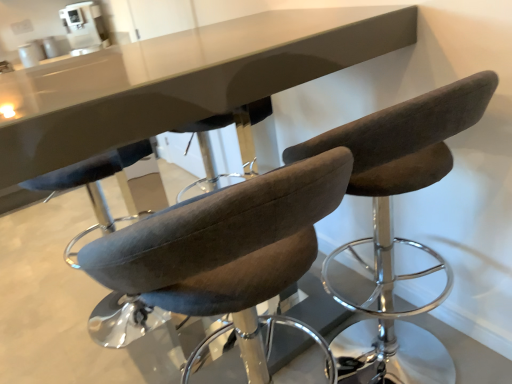
Identify the location of white plastic coffee machine at upper center. The image size is (512, 384). (84, 27).

You are a GUI agent. You are given a task and a screenshot of the screen. Output one action in this format:
    pyautogui.click(x=<x>, y=<y>)
    Task: Click on the white plastic coffee machine at upper center
    This screenshot has width=512, height=384.
    Given the screenshot: What is the action you would take?
    pyautogui.click(x=84, y=27)

Considering the positions of objects white plastic coffee machine at upper center and velvet brown stool at center, the 2th chair from the right, in the image provided, who is more to the right, white plastic coffee machine at upper center or velvet brown stool at center, the 2th chair from the right,?

From the viewer's perspective, velvet brown stool at center, the 2th chair from the right, appears more on the right side.

Who is bigger, white plastic coffee machine at upper center or velvet brown stool at center, the 1th chair viewed from the left?

With larger size is velvet brown stool at center, the 1th chair viewed from the left.

Does white plastic coffee machine at upper center have a lesser height compared to velvet brown stool at center, the 2th chair from the right?

Correct, white plastic coffee machine at upper center is not as tall as velvet brown stool at center, the 2th chair from the right.

How distant is white plastic coffee machine at upper center from velvet brown stool at center, the 1th chair viewed from the left?

3.12 meters.

How different are the orientations of dark brown fabric chair at center, acting as the second chair starting from the left, and white plastic coffee machine at upper center in degrees?

The angle between the facing direction of dark brown fabric chair at center, acting as the second chair starting from the left, and the facing direction of white plastic coffee machine at upper center is 146 degrees.

From a real-world perspective, who is located higher, dark brown fabric chair at center, positioned as the first chair in right-to-left order, or white plastic coffee machine at upper center?

white plastic coffee machine at upper center is physically above.

Looking at this image, is dark brown fabric chair at center, positioned as the first chair in right-to-left order, wider than white plastic coffee machine at upper center?

Yes.

Is dark brown fabric chair at center, acting as the second chair starting from the left, positioned with its back to white plastic coffee machine at upper center?

No, dark brown fabric chair at center, acting as the second chair starting from the left, is not facing away from white plastic coffee machine at upper center.

Is white plastic coffee machine at upper center facing away from dark brown fabric chair at center, positioned as the first chair in right-to-left order?

white plastic coffee machine at upper center is not turned away from dark brown fabric chair at center, positioned as the first chair in right-to-left order.

Does white plastic coffee machine at upper center have a greater width compared to dark brown fabric chair at center, positioned as the first chair in right-to-left order?

In fact, white plastic coffee machine at upper center might be narrower than dark brown fabric chair at center, positioned as the first chair in right-to-left order.

From a real-world perspective, is white plastic coffee machine at upper center positioned over dark brown fabric chair at center, positioned as the first chair in right-to-left order, based on gravity?

Indeed, from a real-world perspective, white plastic coffee machine at upper center stands above dark brown fabric chair at center, positioned as the first chair in right-to-left order.

Is dark brown fabric chair at center, positioned as the first chair in right-to-left order, surrounded by white plastic coffee machine at upper center?

That's incorrect, dark brown fabric chair at center, positioned as the first chair in right-to-left order, is not inside white plastic coffee machine at upper center.

Can you see dark brown fabric chair at center, acting as the second chair starting from the left, touching velvet brown stool at center, the 1th chair viewed from the left?

dark brown fabric chair at center, acting as the second chair starting from the left, and velvet brown stool at center, the 1th chair viewed from the left, are not in contact.

Could you tell me if dark brown fabric chair at center, acting as the second chair starting from the left, is turned towards velvet brown stool at center, the 1th chair viewed from the left?

No.

Is dark brown fabric chair at center, positioned as the first chair in right-to-left order, situated inside velvet brown stool at center, the 2th chair from the right, or outside?

dark brown fabric chair at center, positioned as the first chair in right-to-left order, is not enclosed by velvet brown stool at center, the 2th chair from the right.

Is point (442, 101) behind point (170, 284)?

That is True.

From the image's perspective, relative to white plastic coffee machine at upper center, is velvet brown stool at center, the 1th chair viewed from the left, above or below?

velvet brown stool at center, the 1th chair viewed from the left, is situated lower than white plastic coffee machine at upper center in the image.

Who is taller, velvet brown stool at center, the 2th chair from the right, or white plastic coffee machine at upper center?

Standing taller between the two is velvet brown stool at center, the 2th chair from the right.

Does point (302, 194) come in front of point (87, 48)?

Yes, it is.

Is velvet brown stool at center, the 2th chair from the right, aimed at white plastic coffee machine at upper center?

Yes.

Considering the relative positions of velvet brown stool at center, the 2th chair from the right, and dark brown fabric chair at center, positioned as the first chair in right-to-left order, in the image provided, is velvet brown stool at center, the 2th chair from the right, to the left or to the right of dark brown fabric chair at center, positioned as the first chair in right-to-left order,?

velvet brown stool at center, the 2th chair from the right, is to the left of dark brown fabric chair at center, positioned as the first chair in right-to-left order.

Measure the distance between velvet brown stool at center, the 1th chair viewed from the left, and dark brown fabric chair at center, acting as the second chair starting from the left.

velvet brown stool at center, the 1th chair viewed from the left, and dark brown fabric chair at center, acting as the second chair starting from the left, are 32.34 centimeters apart from each other.

Is velvet brown stool at center, the 2th chair from the right, shorter than dark brown fabric chair at center, acting as the second chair starting from the left?

Yes, velvet brown stool at center, the 2th chair from the right, is shorter than dark brown fabric chair at center, acting as the second chair starting from the left.

Where is `the 1st chair to the right when counting from the white plastic coffee machine at upper center`? This screenshot has height=384, width=512. the 1st chair to the right when counting from the white plastic coffee machine at upper center is located at coordinates (219, 226).

Where is `coffee machine above the dark brown fabric chair at center, positioned as the first chair in right-to-left order (from the image's perspective)`? The width and height of the screenshot is (512, 384). coffee machine above the dark brown fabric chair at center, positioned as the first chair in right-to-left order (from the image's perspective) is located at coordinates (84, 27).

Based on their spatial positions, is white plastic coffee machine at upper center or dark brown fabric chair at center, acting as the second chair starting from the left, further from velvet brown stool at center, the 1th chair viewed from the left?

white plastic coffee machine at upper center.

Looking at the image, which one is located further to dark brown fabric chair at center, acting as the second chair starting from the left, white plastic coffee machine at upper center or velvet brown stool at center, the 1th chair viewed from the left?

Based on the image, white plastic coffee machine at upper center appears to be further to dark brown fabric chair at center, acting as the second chair starting from the left.

Based on their spatial positions, is dark brown fabric chair at center, acting as the second chair starting from the left, or white plastic coffee machine at upper center closer to velvet brown stool at center, the 2th chair from the right?

Based on the image, dark brown fabric chair at center, acting as the second chair starting from the left, appears to be nearer to velvet brown stool at center, the 2th chair from the right.

Based on their spatial positions, is velvet brown stool at center, the 2th chair from the right, or white plastic coffee machine at upper center further from dark brown fabric chair at center, acting as the second chair starting from the left?

white plastic coffee machine at upper center lies further to dark brown fabric chair at center, acting as the second chair starting from the left, than the other object.

Estimate the real-world distances between objects in this image. Which object is closer to white plastic coffee machine at upper center, dark brown fabric chair at center, positioned as the first chair in right-to-left order, or velvet brown stool at center, the 2th chair from the right?

dark brown fabric chair at center, positioned as the first chair in right-to-left order, is closer to white plastic coffee machine at upper center.

From the image, which object appears to be nearer to white plastic coffee machine at upper center, velvet brown stool at center, the 1th chair viewed from the left, or dark brown fabric chair at center, positioned as the first chair in right-to-left order?

dark brown fabric chair at center, positioned as the first chair in right-to-left order.

The width and height of the screenshot is (512, 384). I want to click on chair between velvet brown stool at center, the 2th chair from the right, and white plastic coffee machine at upper center from front to back, so tap(402, 153).